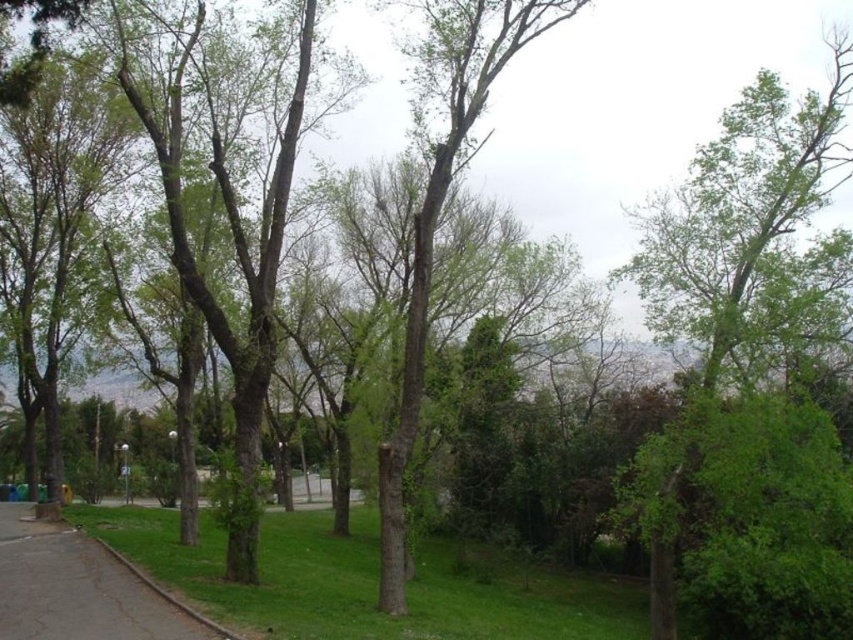
Between green leafy tree at center and concrete sidewalk at lower left, which one appears on the right side from the viewer's perspective?

green leafy tree at center

What do you see at coordinates (442, 202) in the screenshot? I see `green leafy tree at center` at bounding box center [442, 202].

The width and height of the screenshot is (853, 640). Describe the element at coordinates (442, 202) in the screenshot. I see `green leafy tree at center` at that location.

Where is `green leafy tree at center`? Image resolution: width=853 pixels, height=640 pixels. green leafy tree at center is located at coordinates (442, 202).